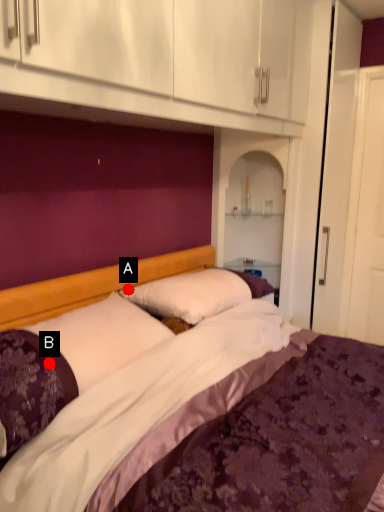
Question: Two points are circled on the image, labeled by A and B beside each circle. Which point is closer to the camera?

Choices:
 (A) A is closer
 (B) B is closer

Answer: (B)